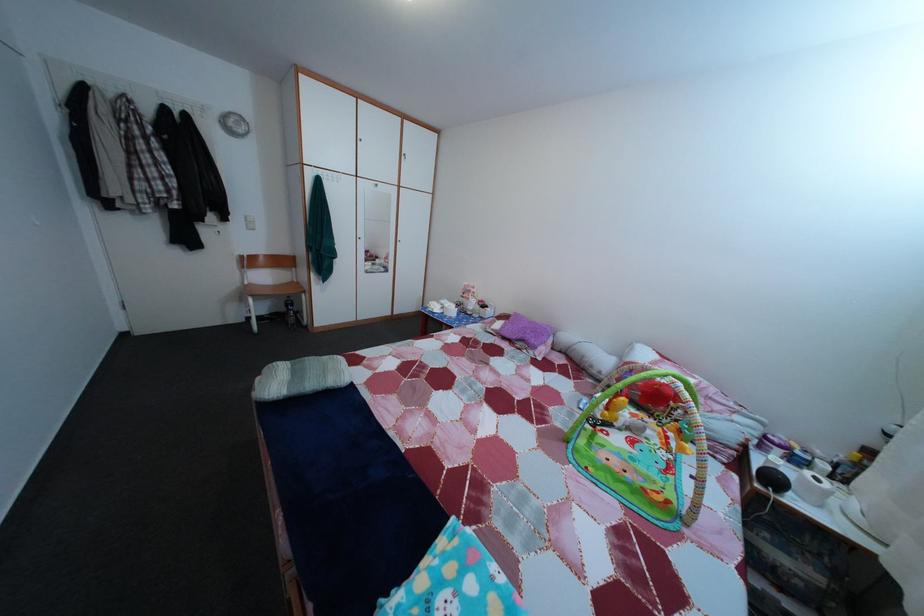
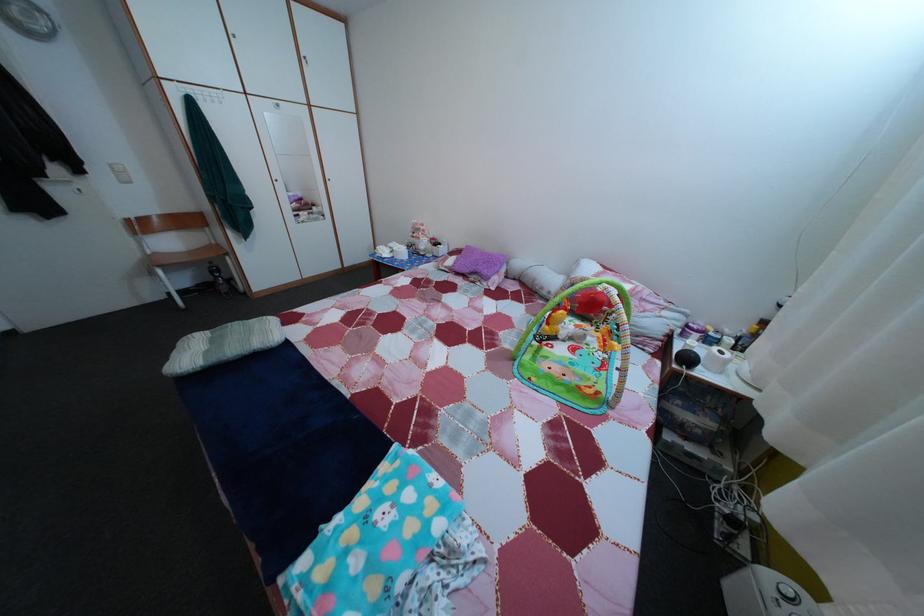
Locate, in the second image, the point that corresponds to the point at 256,228 in the first image.

(123, 177)